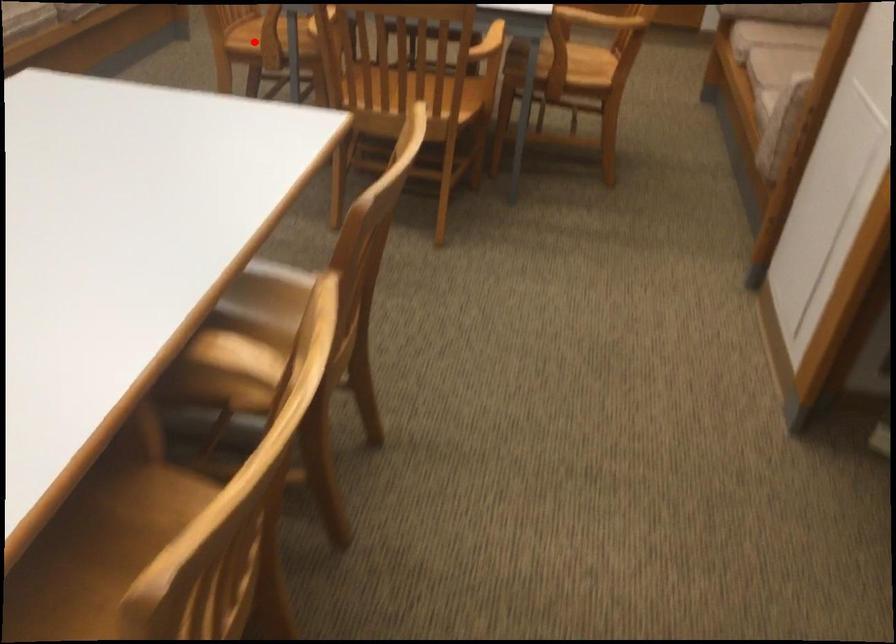
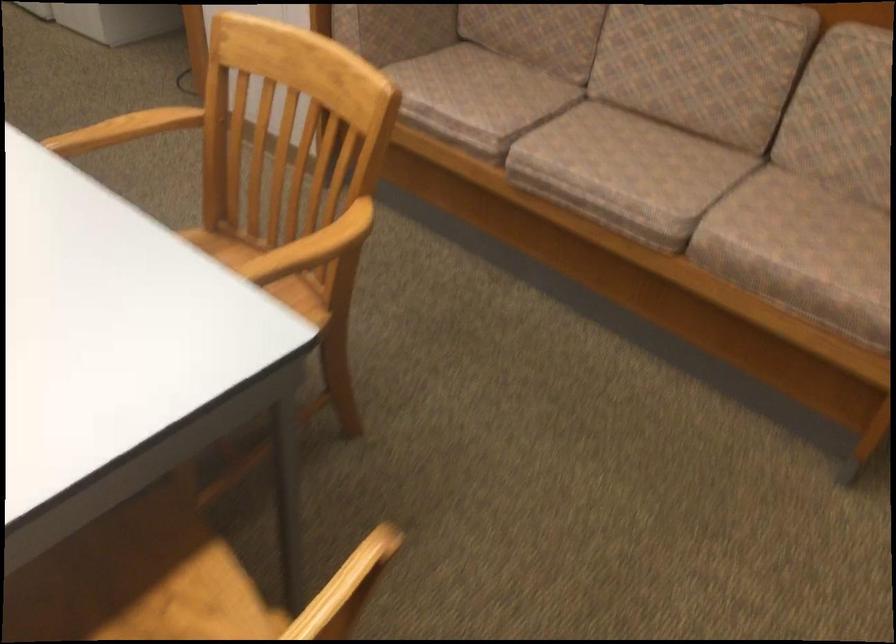
Question: I am providing you with two images of the same scene from different viewpoints. A red point is marked on the first image. Can you still see the location of the red point in image 2?

Choices:
 (A) Yes
 (B) No

Answer: (B)